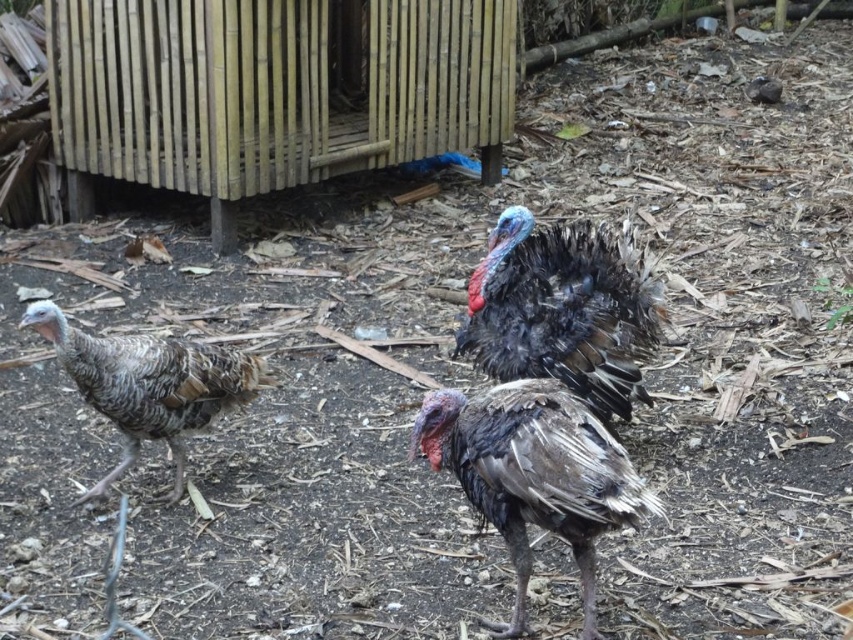
You are a photographer trying to capture a clear photo of the gray matte turkey at center. However, the dark feathered turkey at center is blocking your view. Can you move around to the left side to get an unobstructed shot?

The gray matte turkey at center is behind the dark feathered turkey at center, so moving to the left side might allow you to see around the dark feathered turkey at center and capture the gray matte turkey at center without obstruction.

You are a farmer observing the turkeys in the dirt and leaf covered ground. You need to identify which turkey is bigger between the dark feathered turkey at center and the gray matte turkey at center. Which one is larger?

The dark feathered turkey at center is larger in size than the gray matte turkey at center.

You are observing the turkeys in the scene. From your viewpoint, which turkey is closer to you, the gray matte turkey at center or the gray speckled turkey at left?

The gray matte turkey at center is closer because it is positioned in front of the gray speckled turkey at left, meaning it is nearer to the viewer.